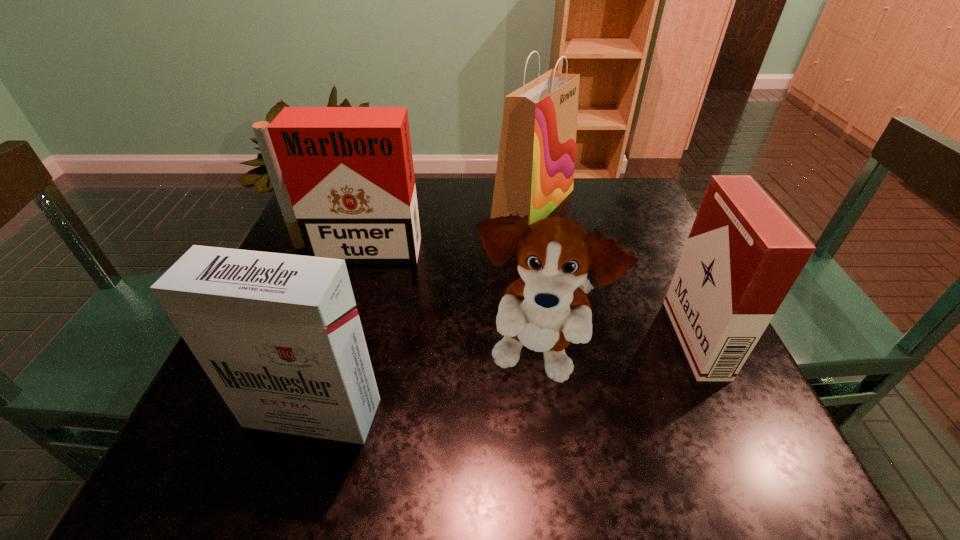
Identify the location of free space located 0.190m on the back of the nearest cigarette_case. The height and width of the screenshot is (540, 960). (347, 305).

The width and height of the screenshot is (960, 540). Identify the location of vacant region located 0.180m on the front-facing side of the rightmost cigarette_case. (583, 339).

The height and width of the screenshot is (540, 960). I want to click on free region located on the front-facing side of the rightmost cigarette_case, so click(x=562, y=339).

Locate an element on the screen. blank space located 0.400m on the front-facing side of the rightmost cigarette_case is located at coordinates (467, 339).

Find the location of a particular element. This screenshot has width=960, height=540. object that is at the far edge is located at coordinates (535, 169).

You are a GUI agent. You are given a task and a screenshot of the screen. Output one action in this format:
    pyautogui.click(x=<x>, y=<y>)
    Task: Click on the object present at the near edge
    The image size is (960, 540).
    Given the screenshot: What is the action you would take?
    pyautogui.click(x=279, y=335)

The width and height of the screenshot is (960, 540). Identify the location of object that is at the right edge. (743, 254).

This screenshot has height=540, width=960. I want to click on object located in the near left corner section of the desktop, so click(279, 335).

Identify the location of free location at the far edge. (568, 216).

In the image, there is a desktop. Where is `free region at the near edge`? This screenshot has width=960, height=540. free region at the near edge is located at coordinates coord(607,435).